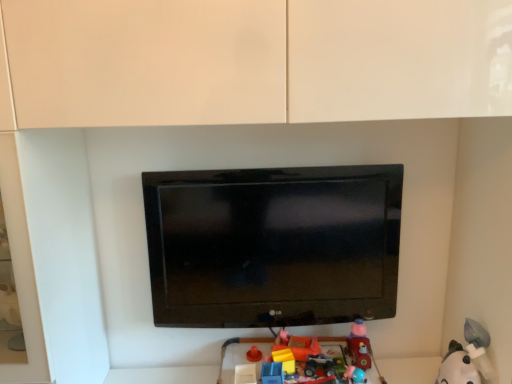
Question: Can you confirm if matte plastic toy car at lower right, positioned as the 2th toy in right-to-left order, is smaller than blue plastic toy at lower center, marked as the 4th toy in a right-to-left arrangement?

Choices:
 (A) no
 (B) yes

Answer: (A)

Question: Considering the relative positions of matte plastic toy car at lower right, the 3th toy positioned from the left, and blue plastic toy at lower center, marked as the 4th toy in a right-to-left arrangement, in the image provided, is matte plastic toy car at lower right, the 3th toy positioned from the left, behind blue plastic toy at lower center, marked as the 4th toy in a right-to-left arrangement,?

Choices:
 (A) no
 (B) yes

Answer: (B)

Question: Is matte plastic toy car at lower right, the 3th toy positioned from the left, taller than blue plastic toy at lower center, acting as the first toy starting from the left?

Choices:
 (A) yes
 (B) no

Answer: (A)

Question: Is matte plastic toy car at lower right, positioned as the 2th toy in right-to-left order, looking in the opposite direction of blue plastic toy at lower center, acting as the first toy starting from the left?

Choices:
 (A) yes
 (B) no

Answer: (B)

Question: Does matte plastic toy car at lower right, positioned as the 2th toy in right-to-left order, appear on the right side of blue plastic toy at lower center, acting as the first toy starting from the left?

Choices:
 (A) no
 (B) yes

Answer: (B)

Question: Is matte plastic toy car at lower right, positioned as the 2th toy in right-to-left order, aimed at blue plastic toy at lower center, marked as the 4th toy in a right-to-left arrangement?

Choices:
 (A) yes
 (B) no

Answer: (B)

Question: From the image's perspective, is black glossy tv at center over white plush toy at lower right, placed as the 4th toy when sorted from left to right?

Choices:
 (A) no
 (B) yes

Answer: (B)

Question: Can you see black glossy tv at center touching white plush toy at lower right, placed as the 4th toy when sorted from left to right?

Choices:
 (A) yes
 (B) no

Answer: (B)

Question: Considering the relative positions of black glossy tv at center and white plush toy at lower right, placed as the 4th toy when sorted from left to right, in the image provided, is black glossy tv at center in front of white plush toy at lower right, placed as the 4th toy when sorted from left to right,?

Choices:
 (A) no
 (B) yes

Answer: (A)

Question: Is white plush toy at lower right, placed as the 4th toy when sorted from left to right, a part of black glossy tv at center?

Choices:
 (A) yes
 (B) no

Answer: (B)

Question: Does black glossy tv at center have a lesser height compared to white plush toy at lower right, which is the first toy from right to left?

Choices:
 (A) no
 (B) yes

Answer: (A)

Question: Does black glossy tv at center appear on the left side of white plush toy at lower right, placed as the 4th toy when sorted from left to right?

Choices:
 (A) yes
 (B) no

Answer: (A)

Question: Considering the relative sizes of blue plastic toy at lower center, marked as the 4th toy in a right-to-left arrangement, and white plush toy at lower right, placed as the 4th toy when sorted from left to right, in the image provided, is blue plastic toy at lower center, marked as the 4th toy in a right-to-left arrangement, wider than white plush toy at lower right, placed as the 4th toy when sorted from left to right,?

Choices:
 (A) no
 (B) yes

Answer: (A)